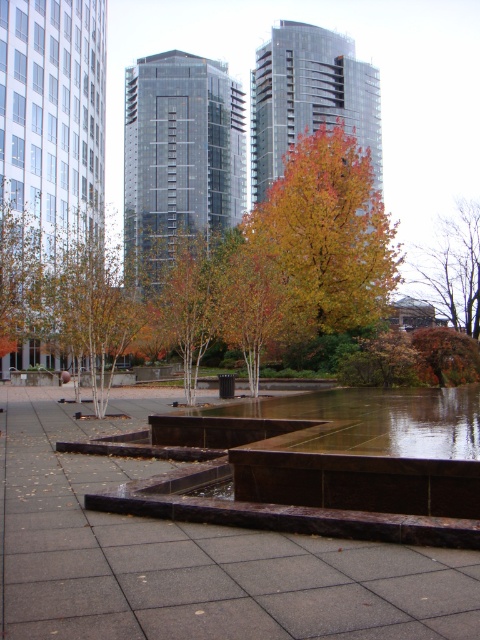
Question: Which of these objects is positioned farthest from the dark gray concrete pavement at center?

Choices:
 (A) autumn leaves at center
 (B) glossy concrete puddle at center
 (C) autumn leaves tree at center

Answer: (A)

Question: Does autumn leaves tree at center appear on the right side of glossy concrete puddle at center?

Choices:
 (A) no
 (B) yes

Answer: (B)

Question: Does dark gray concrete pavement at center have a lesser width compared to autumn leaves tree at center?

Choices:
 (A) no
 (B) yes

Answer: (B)

Question: Estimate the real-world distances between objects in this image. Which object is closer to the autumn leaves tree at center?

Choices:
 (A) glossy concrete puddle at center
 (B) autumn leaves at center

Answer: (B)

Question: Which object appears closest to the camera in this image?

Choices:
 (A) glossy concrete puddle at center
 (B) dark gray concrete pavement at center

Answer: (B)

Question: Can you confirm if dark gray concrete pavement at center is smaller than glossy concrete puddle at center?

Choices:
 (A) yes
 (B) no

Answer: (B)